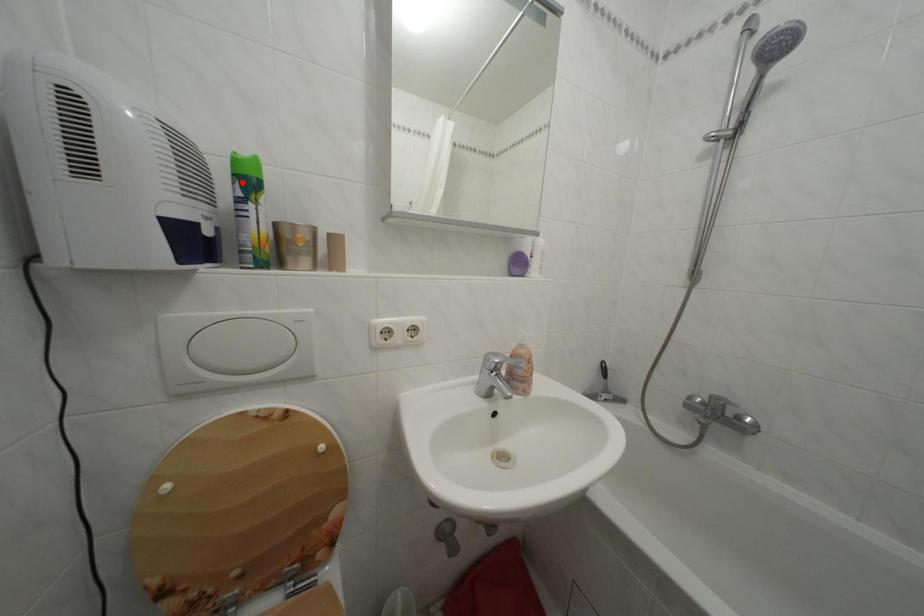
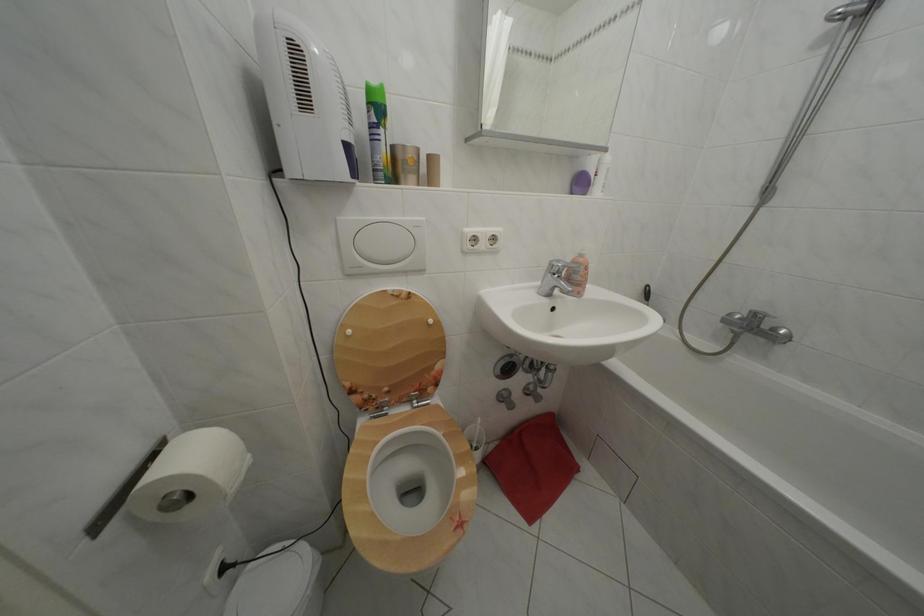
Locate, in the second image, the point that corresponds to the highlighted location in the first image.

(378, 110)